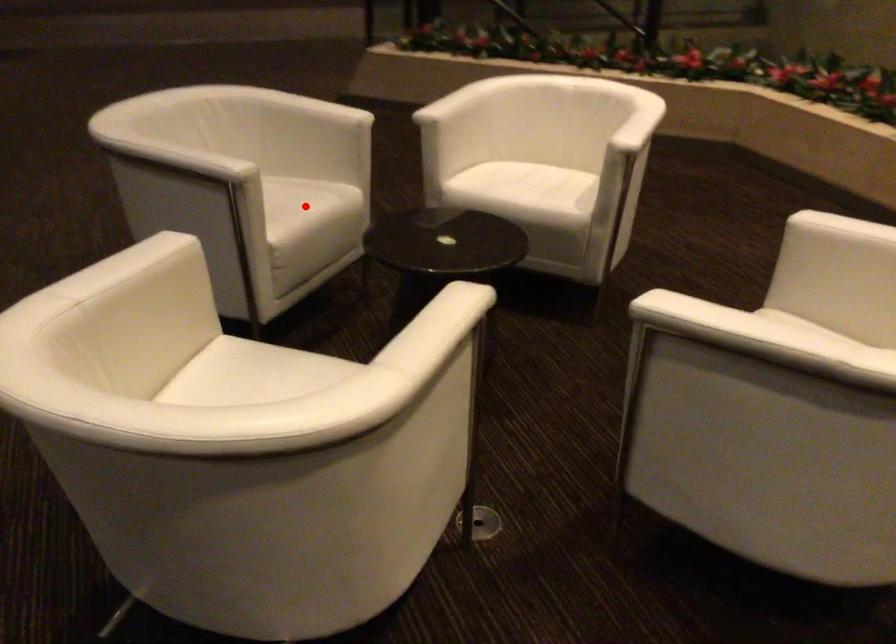
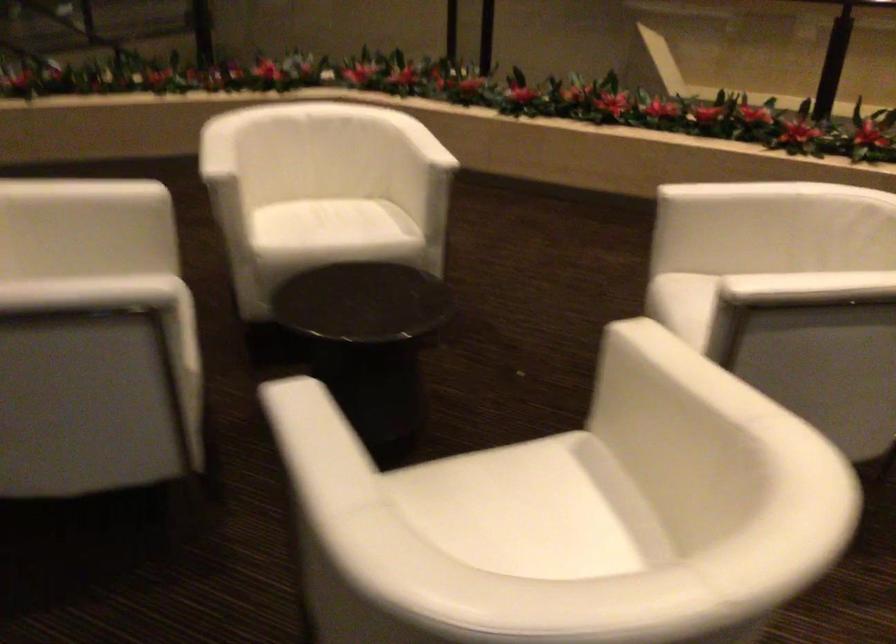
Question: I am providing you with two images of the same scene from different viewpoints. A red point is marked on the first image. Can you still see the location of the red point in image 2?

Choices:
 (A) Yes
 (B) No

Answer: (B)